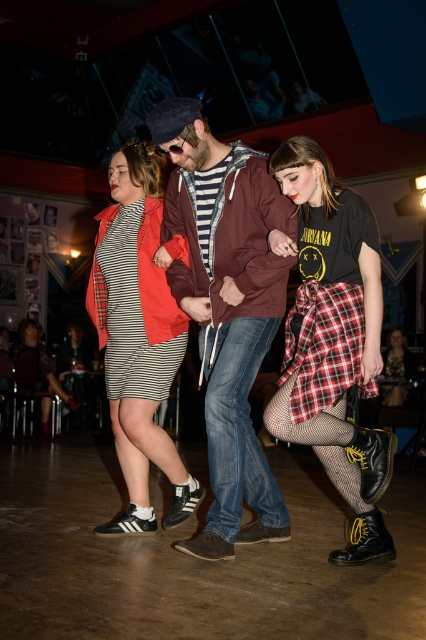
Question: Estimate the real-world distances between objects in this image. Which object is closer to the plaid fabric skirt at center?

Choices:
 (A) white leather sneakers at center
 (B) matte maroon hoodie at center
 (C) striped cotton dress at center
 (D) matte black shoes at center

Answer: (D)

Question: Which point is closer to the camera taking this photo?

Choices:
 (A) (106, 337)
 (B) (213, 499)
 (C) (336, 228)

Answer: (C)

Question: Is white leather sneakers at center to the right of striped cotton dress at center from the viewer's perspective?

Choices:
 (A) no
 (B) yes

Answer: (B)

Question: Observing the image, what is the correct spatial positioning of matte black shoes at center in reference to white leather sneakers at center?

Choices:
 (A) right
 (B) left

Answer: (A)

Question: Can you confirm if matte black shoes at center is thinner than plaid fabric skirt at lower right?

Choices:
 (A) yes
 (B) no

Answer: (B)

Question: Based on their relative distances, which object is nearer to the plaid fabric skirt at center?

Choices:
 (A) striped cotton dress at center
 (B) white leather sneakers at center
 (C) matte maroon hoodie at center

Answer: (C)